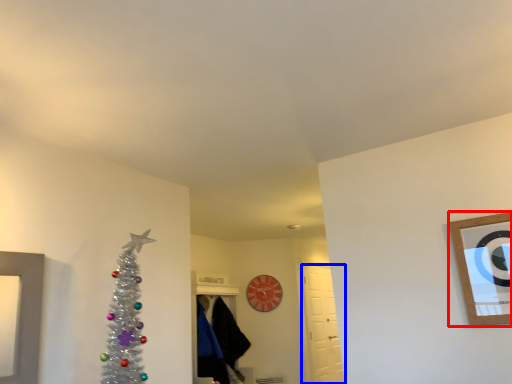
Question: Which point is closer to the camera, picture frame (highlighted by a red box) or door (highlighted by a blue box)?

Choices:
 (A) picture frame
 (B) door

Answer: (A)